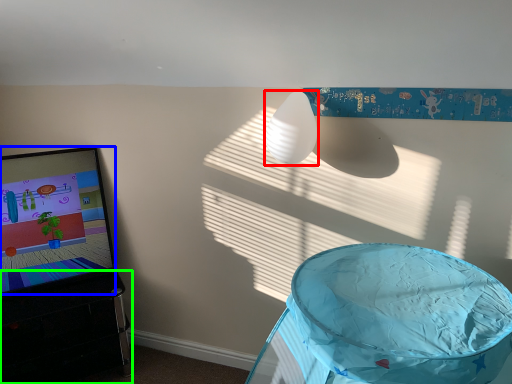
Question: Which object is positioned closest to lamp (highlighted by a red box)? Select from computer screen (highlighted by a blue box) and furniture (highlighted by a green box).

Choices:
 (A) computer screen
 (B) furniture

Answer: (A)